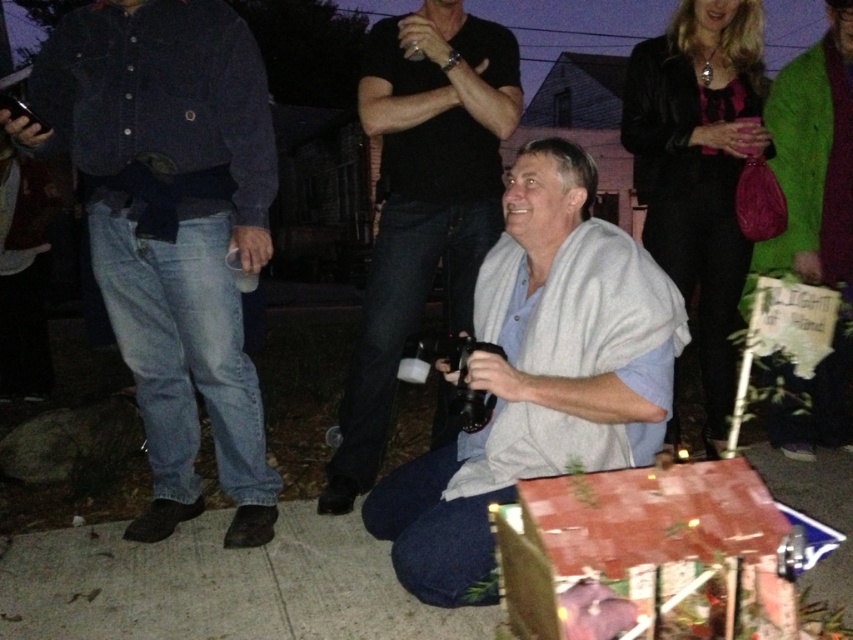
Is gray woolen scarf at center bigger than green fuzzy robe at upper right?

No.

Describe the element at coordinates (486, 492) in the screenshot. This screenshot has height=640, width=853. I see `gray woolen scarf at center` at that location.

Locate an element on the screen. The width and height of the screenshot is (853, 640). gray woolen scarf at center is located at coordinates (486, 492).

The height and width of the screenshot is (640, 853). Find the location of `gray woolen scarf at center`. gray woolen scarf at center is located at coordinates (486, 492).

Is matte black camera at center thinner than green fuzzy robe at upper right?

Indeed, matte black camera at center has a lesser width compared to green fuzzy robe at upper right.

Is point (459, 150) behind point (782, 248)?

No, (459, 150) is closer to viewer.

Find the location of a particular element. Image resolution: width=853 pixels, height=640 pixels. matte black camera at center is located at coordinates (422, 202).

Is dark blue denim jeans at left above green fuzzy robe at upper right?

No.

Does dark blue denim jeans at left have a lesser width compared to green fuzzy robe at upper right?

Indeed, dark blue denim jeans at left has a lesser width compared to green fuzzy robe at upper right.

You are a GUI agent. You are given a task and a screenshot of the screen. Output one action in this format:
    pyautogui.click(x=<x>, y=<y>)
    Task: Click on the dark blue denim jeans at left
    
    Given the screenshot: What is the action you would take?
    pyautogui.click(x=171, y=227)

In order to click on dark blue denim jeans at left in this screenshot , I will do `click(171, 227)`.